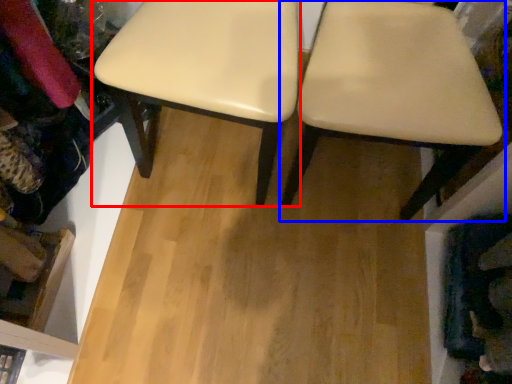
Question: Which point is closer to the camera, stool (highlighted by a red box) or chair (highlighted by a blue box)?

Choices:
 (A) stool
 (B) chair

Answer: (B)